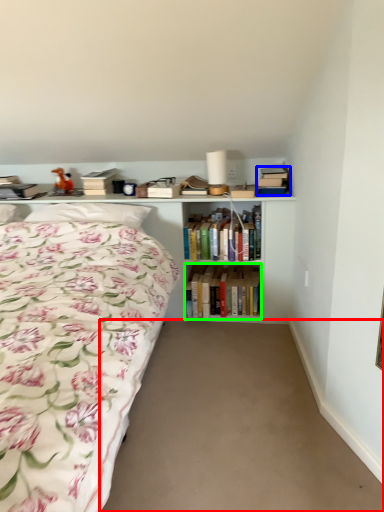
Question: Which object is positioned closest to plain (highlighted by a red box)? Select from book (highlighted by a blue box) and book (highlighted by a green box).

Choices:
 (A) book
 (B) book

Answer: (B)